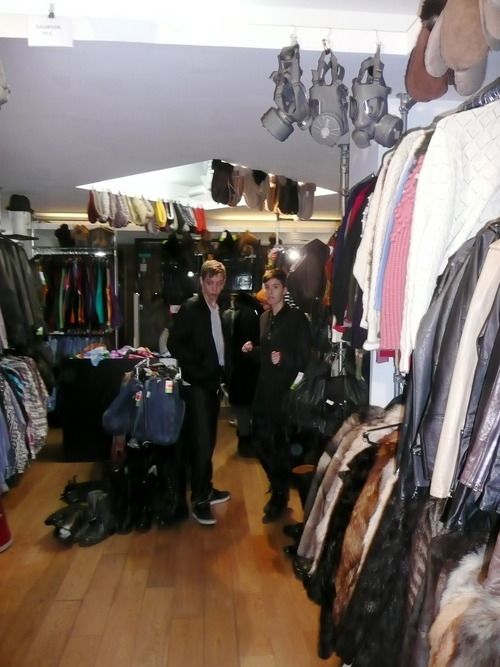
I want to click on styrofoam head, so 15,223.